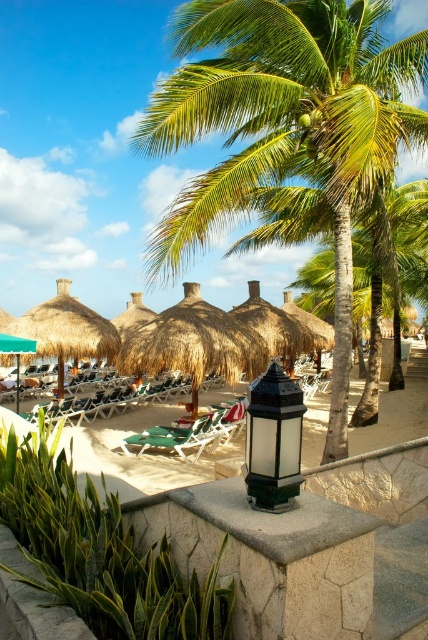
Between green leafy palm tree at center and thatched straw umbrella at left, which one has more height?

With more height is green leafy palm tree at center.

Between point (269, 100) and point (86, 344), which one is positioned in front?

Point (269, 100) is more forward.

Which is behind, point (419, 141) or point (88, 326)?

The point (88, 326) is behind.

The width and height of the screenshot is (428, 640). In order to click on green leafy palm tree at center in this screenshot , I will do `click(285, 132)`.

Is point (291, 387) behind point (61, 371)?

No.

Does green glass lantern at center appear under thatched straw umbrella at left?

Correct, green glass lantern at center is located below thatched straw umbrella at left.

I want to click on green glass lantern at center, so click(x=273, y=442).

Can you confirm if thatched straw umbrellas at center is positioned below green fabric beach chair at center?

No, thatched straw umbrellas at center is not below green fabric beach chair at center.

Is thatched straw umbrellas at center to the left of green fabric beach chair at center from the viewer's perspective?

Indeed, thatched straw umbrellas at center is positioned on the left side of green fabric beach chair at center.

Measure the distance between point (143, 353) and camera.

They are 10.86 meters apart.

I want to click on thatched straw umbrellas at center, so click(193, 342).